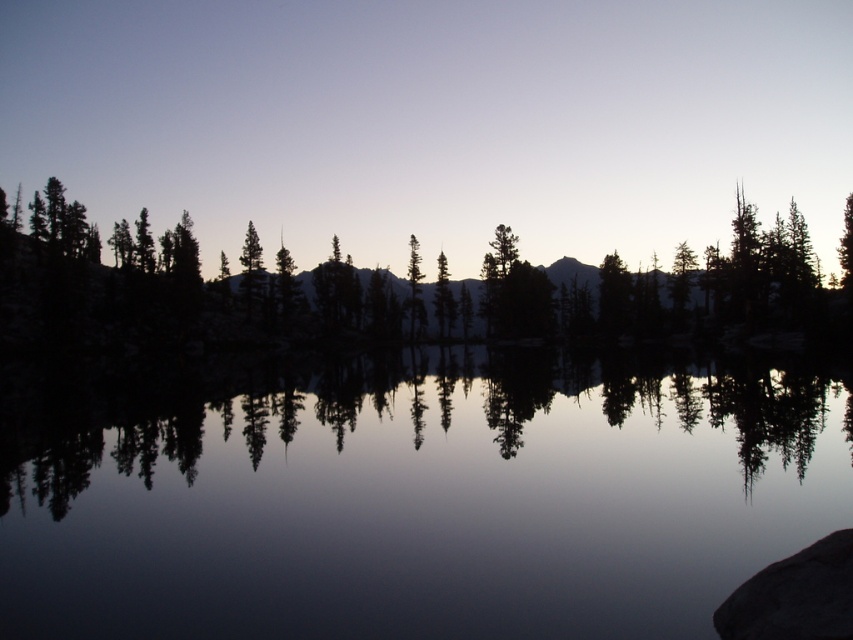
Can you confirm if transparent water at center is bigger than silhouette tree at left?

Incorrect, transparent water at center is not larger than silhouette tree at left.

Does transparent water at center appear on the left side of silhouette tree at left?

Indeed, transparent water at center is positioned on the left side of silhouette tree at left.

The height and width of the screenshot is (640, 853). What do you see at coordinates (430, 500) in the screenshot?
I see `transparent water at center` at bounding box center [430, 500].

This screenshot has height=640, width=853. I want to click on transparent water at center, so click(430, 500).

Does silhouette tree at left appear over black rock at lower right?

Indeed, silhouette tree at left is positioned over black rock at lower right.

Between silhouette tree at left and black rock at lower right, which one has less height?

black rock at lower right

What do you see at coordinates (173, 284) in the screenshot? I see `silhouette tree at left` at bounding box center [173, 284].

The height and width of the screenshot is (640, 853). Identify the location of silhouette tree at left. (173, 284).

Is transparent water at center wider than black rock at lower right?

Indeed, transparent water at center has a greater width compared to black rock at lower right.

Can you confirm if transparent water at center is positioned above black rock at lower right?

Actually, transparent water at center is below black rock at lower right.

Between point (451, 426) and point (804, 550), which one is positioned behind?

Positioned behind is point (451, 426).

Where is `transparent water at center`? This screenshot has width=853, height=640. transparent water at center is located at coordinates (430, 500).